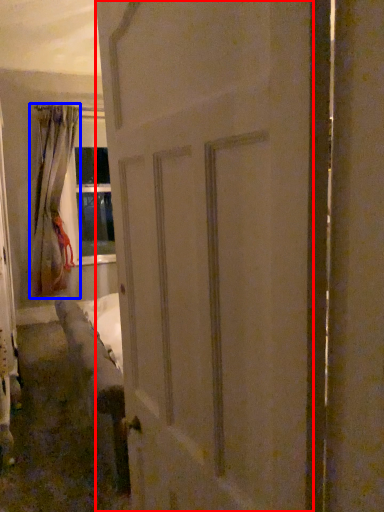
Question: Which object is closer to the camera taking this photo, door (highlighted by a red box) or curtain (highlighted by a blue box)?

Choices:
 (A) door
 (B) curtain

Answer: (A)